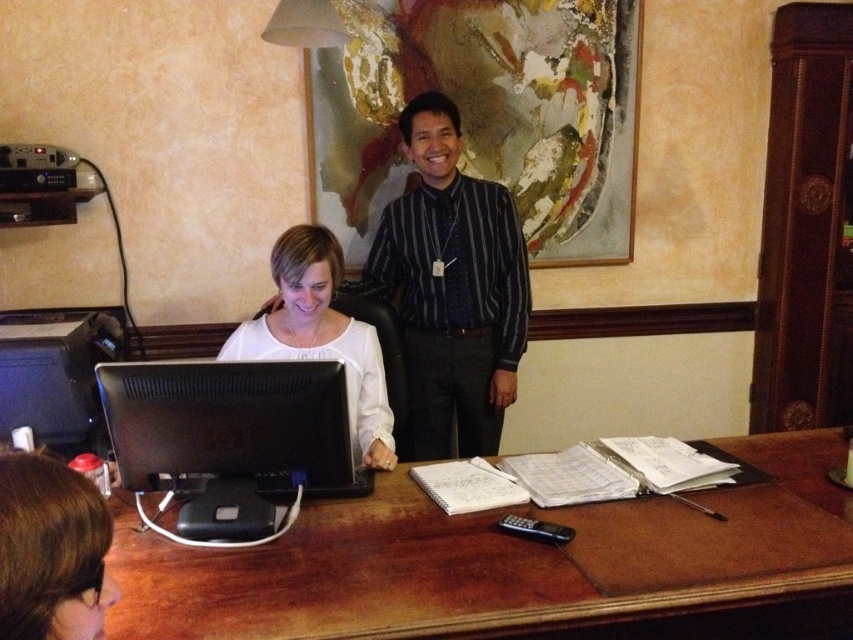
This screenshot has height=640, width=853. Describe the element at coordinates (517, 564) in the screenshot. I see `brown wooden table at center` at that location.

I want to click on brown wooden table at center, so pos(517,564).

Who is lower down, blonde hair at lower left or white matte shirt at center?

blonde hair at lower left is lower down.

Can you confirm if blonde hair at lower left is bigger than white matte shirt at center?

Actually, blonde hair at lower left might be smaller than white matte shirt at center.

At what (x,y) coordinates should I click in order to perform the action: click on blonde hair at lower left. Please return your answer as a coordinate pair (x, y). The height and width of the screenshot is (640, 853). Looking at the image, I should click on (51, 550).

At what (x,y) coordinates should I click in order to perform the action: click on blonde hair at lower left. Please return your answer as a coordinate pair (x, y). The width and height of the screenshot is (853, 640). Looking at the image, I should click on (51, 550).

Does black glossy monitor at center have a lesser width compared to white matte shirt at center?

No.

Between black glossy monitor at center and white matte shirt at center, which one is positioned higher?

white matte shirt at center is higher up.

Which is in front, point (143, 465) or point (335, 340)?

Positioned in front is point (143, 465).

Where is `black glossy monitor at center`? The image size is (853, 640). black glossy monitor at center is located at coordinates (230, 436).